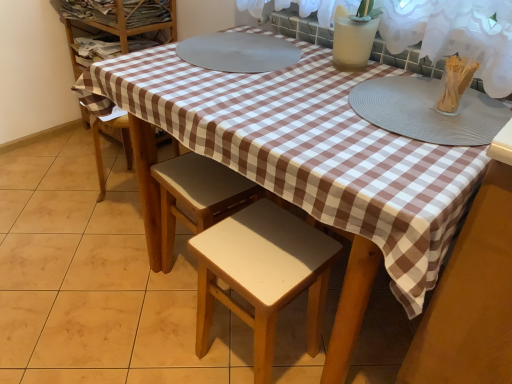
Question: Is gray textured placemat at upper right spatially inside light brown wood stool at center, marked as the 2th stool in a front-to-back arrangement, or outside of it?

Choices:
 (A) inside
 (B) outside

Answer: (B)

Question: Is gray textured placemat at upper right wider or thinner than light brown wood stool at center, which ranks as the 1th stool in back-to-front order?

Choices:
 (A) wide
 (B) thin

Answer: (A)

Question: Which object is positioned farthest from the white matte glass vase at upper right?

Choices:
 (A) white matte stool at lower center, positioned as the 2th stool in back-to-front order
 (B) gray textured placemat at upper right
 (C) light brown wood stool at center, which ranks as the 1th stool in back-to-front order
 (D) clear plastic container at upper right

Answer: (A)

Question: Which of these objects is positioned closest to the light brown wood stool at center, marked as the 2th stool in a front-to-back arrangement?

Choices:
 (A) white matte stool at lower center, which ranks as the first stool in front-to-back order
 (B) gray textured placemat at upper right
 (C) white matte glass vase at upper right
 (D) clear plastic container at upper right

Answer: (A)